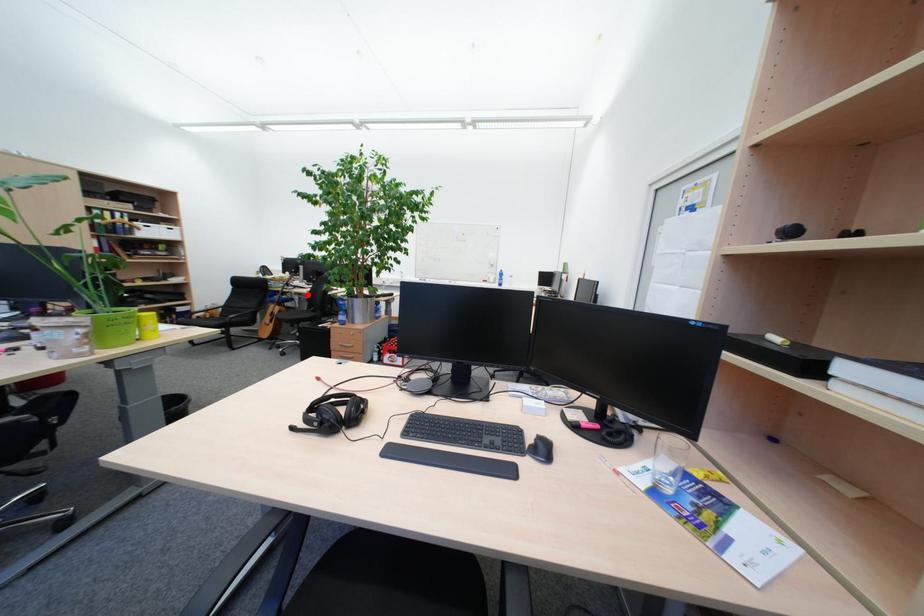
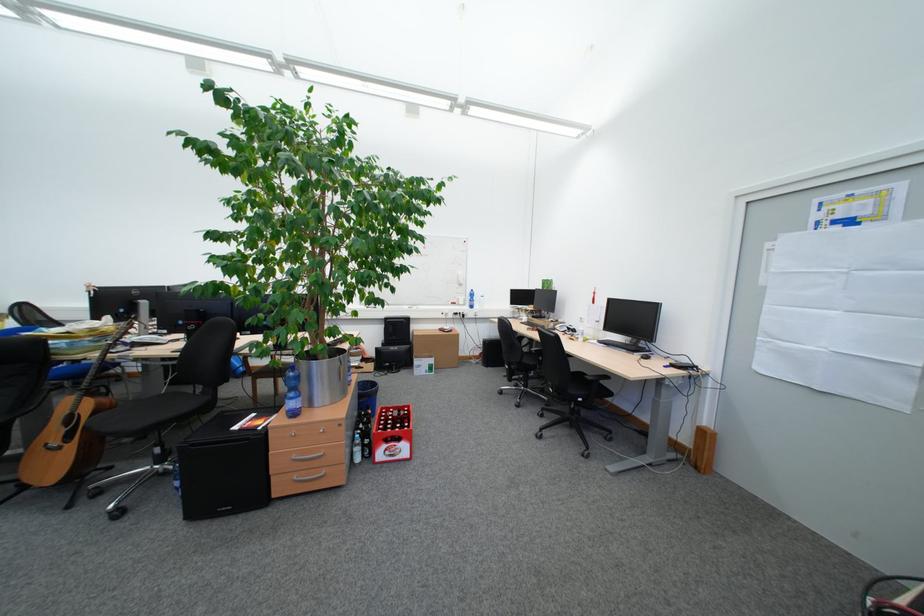
Find the pixel in the second image that matches the highlighted location in the first image.

(150, 360)